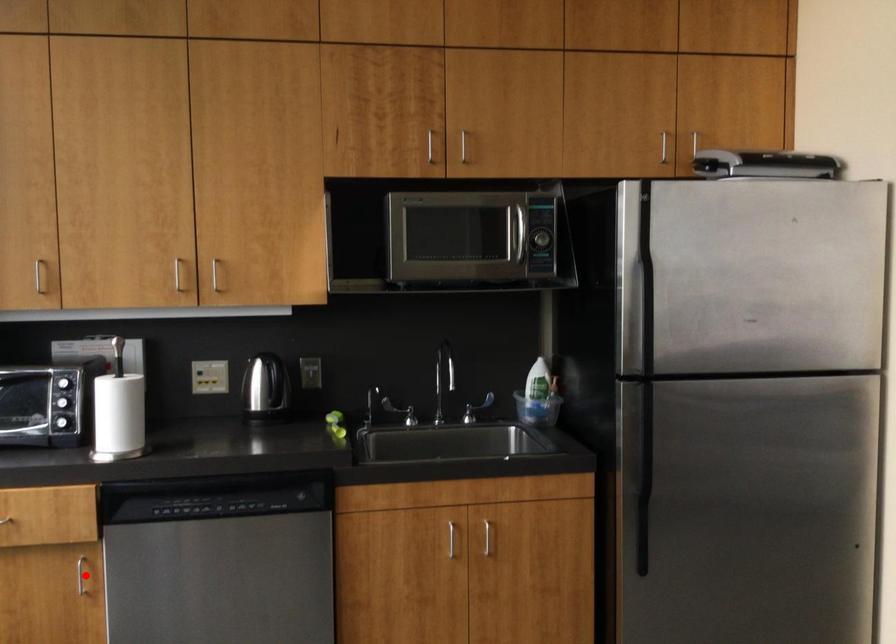
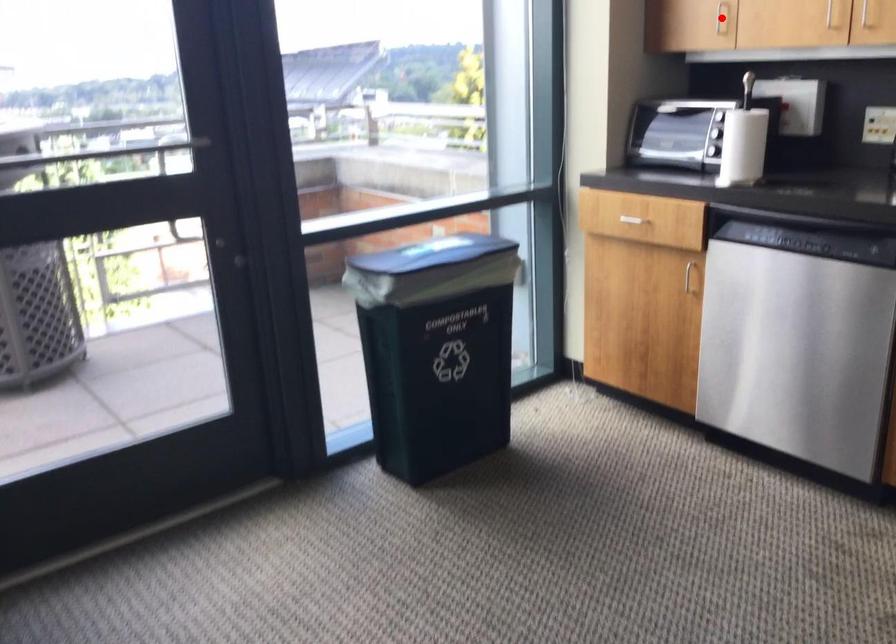
I am providing you with two images of the same scene from different viewpoints. A red point is marked on the first image and another point is marked on the second image. Is the red point in image1 aligned with the point shown in image2?

No